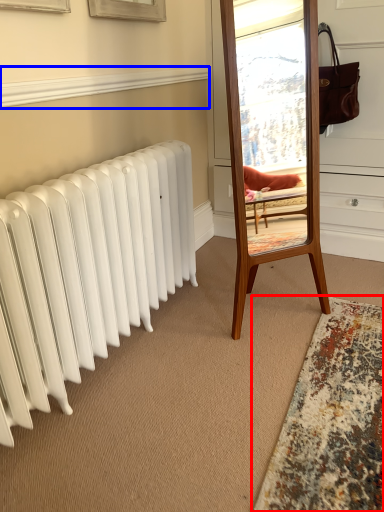
Question: Which object appears closest to the camera in this image, mat (highlighted by a red box) or window sill (highlighted by a blue box)?

Choices:
 (A) mat
 (B) window sill

Answer: (A)